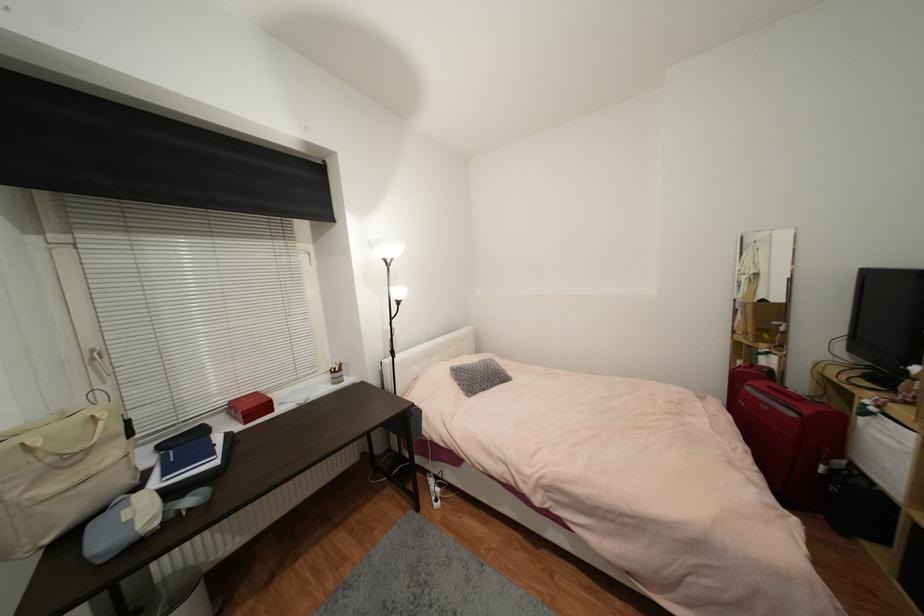
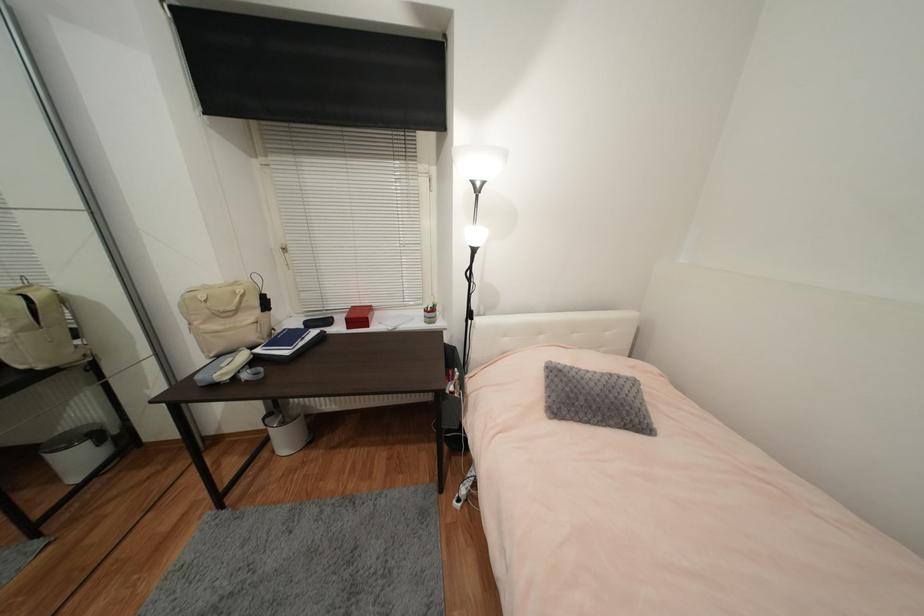
Find the pixel in the second image that matches (x=336, y=374) in the first image.

(430, 312)